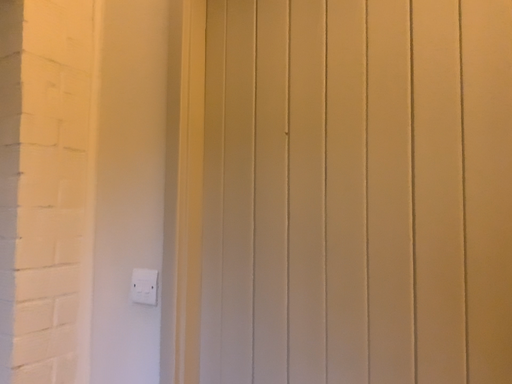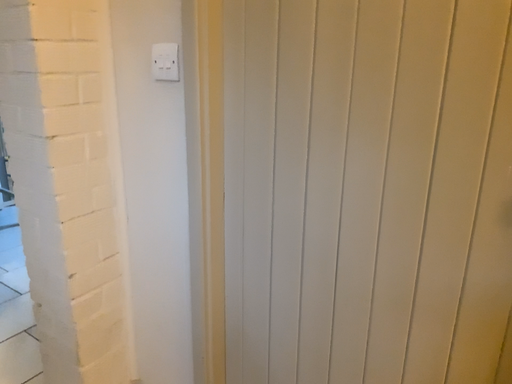
Question: Which way did the camera rotate in the video?

Choices:
 (A) rotated downward
 (B) rotated upward

Answer: (A)